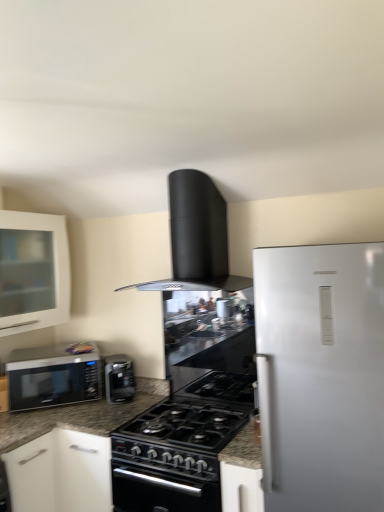
Question: In terms of width, does satin black microwave at left look wider or thinner when compared to black matte range hood at upper center?

Choices:
 (A) thin
 (B) wide

Answer: (A)

Question: From the image's perspective, is satin black microwave at left positioned above or below black matte range hood at upper center?

Choices:
 (A) above
 (B) below

Answer: (B)

Question: Based on their relative distances, which object is nearer to the black matte range hood at upper center?

Choices:
 (A) white glass cabinet at left
 (B) satin black coffee maker at center
 (C) black matte gas stove at center
 (D) satin black microwave at left

Answer: (C)

Question: Estimate the real-world distances between objects in this image. Which object is closer to the satin black microwave at left?

Choices:
 (A) black matte range hood at upper center
 (B) satin black coffee maker at center
 (C) white glass cabinet at left
 (D) black matte gas stove at center

Answer: (B)